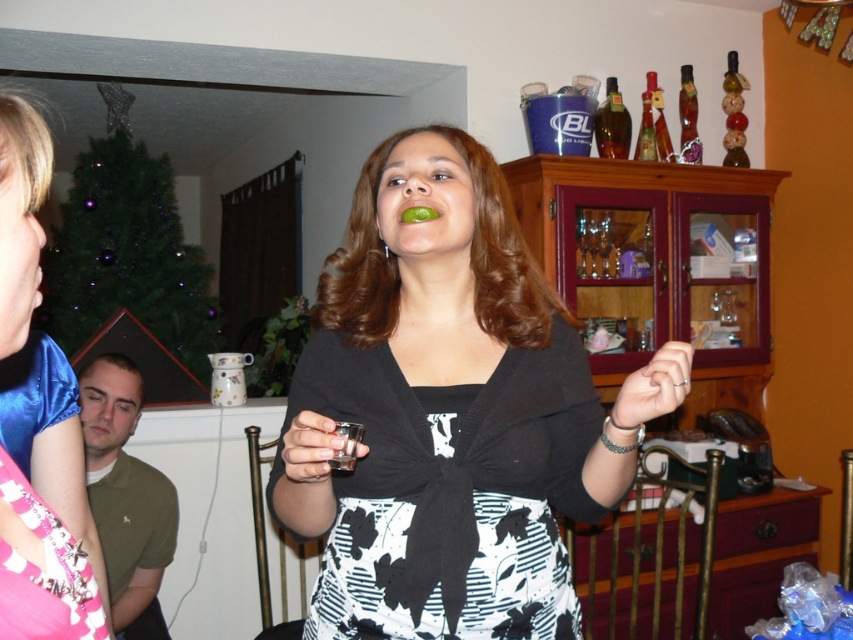
In the scene shown: Can you confirm if translucent glass bottle at upper right is wider than green matte lime at center?

Yes.

Looking at this image, can you confirm if translucent glass bottle at upper right is smaller than green matte lime at center?

No.

The image size is (853, 640). Identify the location of translucent glass bottle at upper right. (612, 124).

You are a GUI agent. You are given a task and a screenshot of the screen. Output one action in this format:
    pyautogui.click(x=<x>, y=<y>)
    Task: Click on the translucent glass bottle at upper right
    
    Given the screenshot: What is the action you would take?
    pyautogui.click(x=612, y=124)

Between black matte dress at center and matte black dress at center, which one has more height?

black matte dress at center

Who is lower down, black matte dress at center or matte black dress at center?

Positioned lower is matte black dress at center.

Who is more distant from viewer, (321, 406) or (25, 337)?

Point (321, 406)

I want to click on black matte dress at center, so click(450, 413).

Measure the distance between matte black dress at center and matte white cup at lower left.

They are 1.48 meters apart.

Which is below, matte black dress at center or matte white cup at lower left?

Positioned lower is matte white cup at lower left.

Between point (0, 472) and point (88, 436), which one is positioned behind?

Point (88, 436)

At what (x,y) coordinates should I click in order to perform the action: click on matte black dress at center. Please return your answer as a coordinate pair (x, y). The image size is (853, 640). Looking at the image, I should click on point(42,568).